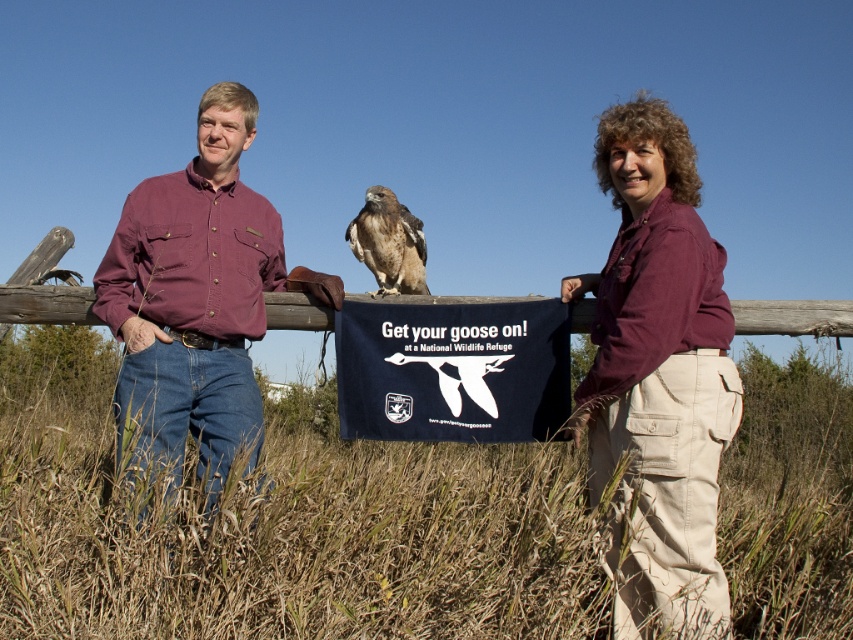
You are standing in a grassy field and see a matte purple shirt at center. If you want to take a photo of it from where you are, will you need a zoom lens to capture the entire shirt in the frame?

The matte purple shirt at center is 9.69 feet away from you. Since this distance is relatively close, you likely do not need a zoom lens to capture the entire shirt in the frame.

You are a photographer taking a picture of the scene. You notice a point at coordinates (659, 372). What object is located at that point?

The point at coordinates (659, 372) corresponds to the matte purple shirt at center.

You are standing in the grassy field and want to place a small flag exactly halfway between point (695, 188) and point (386, 188). Where would you place the flag relative to the wooden fence?

The flag should be placed halfway between point (695, 188) and point (386, 188). Since both points share the same x coordinate of 0.294, the halfway point would be vertically between them along the y axis. The wooden fence is the backdrop behind the banner, so the flag would be placed closer to the fence than either point since the halfway point is between the two points which are both in front of the fence.